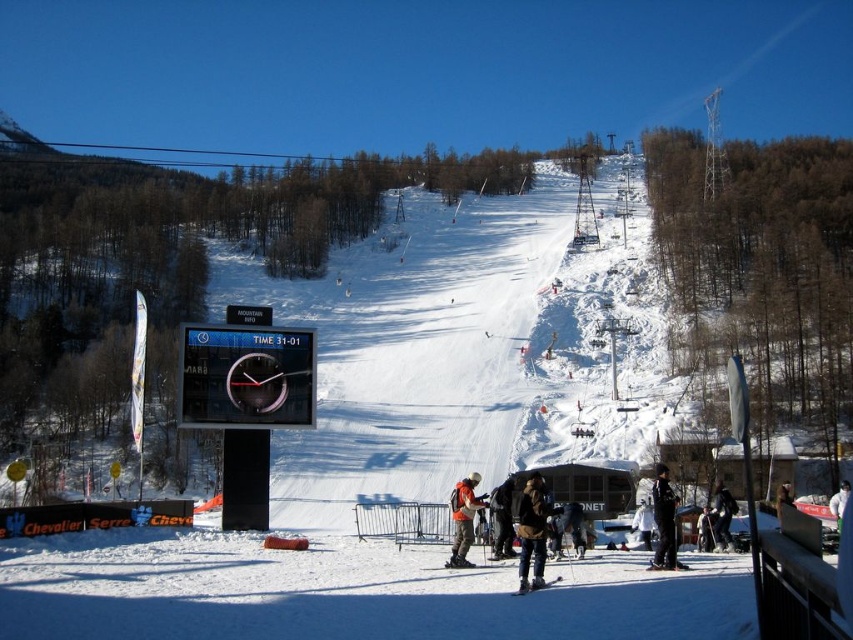
You are a photographer standing at the bottom of the ski slope. You want to take a photo that includes both the dark gray jacket at lower right and the black matte snowboarder at center. Which object should you adjust your camera angle to focus on first to ensure both are in frame?

The dark gray jacket at lower right is much taller than the black matte snowboarder at center, so you should focus on the taller dark gray jacket at lower right first to ensure both are in frame.

You are a photographer standing at the bottom of the ski slope. You want to take a photo that includes both the dark gray jacket at lower right and the white matte ski at center. Which object should you adjust your camera angle to focus on first to ensure both are in frame?

The dark gray jacket at lower right is positioned under the white matte ski at center, so you should focus on the white matte ski at center first to ensure both are visible in the frame.

You are a photographer standing at the bottom of the slope and want to take a photo of both the black matte snowboarder at center and the white matte ski at center. Which object will appear larger in your photo?

The black matte snowboarder at center will appear larger in the photo because it is closer to the photographer than the white matte ski at center.